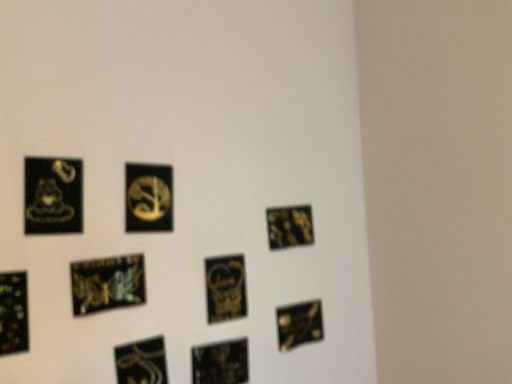
This screenshot has height=384, width=512. Describe the element at coordinates (13, 313) in the screenshot. I see `metallic gold picture frame at lower left, the first picture frame viewed from the left` at that location.

What do you see at coordinates (289, 226) in the screenshot? The image size is (512, 384). I see `metallic gold picture frame at center-right, placed as the 8th picture frame when sorted from left to right` at bounding box center [289, 226].

The height and width of the screenshot is (384, 512). I want to click on metallic gold picture frame at center-right, placed as the 8th picture frame when sorted from left to right, so click(289, 226).

Where is `black glossy sticker at lower left, which is the 4th picture frame from left to right`? black glossy sticker at lower left, which is the 4th picture frame from left to right is located at coordinates (141, 362).

Where is `gold metallic sign at center, which appears as the 3th picture frame when viewed from the right`? gold metallic sign at center, which appears as the 3th picture frame when viewed from the right is located at coordinates (225, 288).

Where is `metallic gold picture frame at lower left, the first picture frame viewed from the left`? The image size is (512, 384). metallic gold picture frame at lower left, the first picture frame viewed from the left is located at coordinates (13, 313).

Considering the positions of objects gold metallic sign at center, which appears as the 3th picture frame when viewed from the right, and metallic gold picture frame at center-right, which is the 2th picture frame from right to left, in the image provided, who is more to the left, gold metallic sign at center, which appears as the 3th picture frame when viewed from the right, or metallic gold picture frame at center-right, which is the 2th picture frame from right to left,?

gold metallic sign at center, which appears as the 3th picture frame when viewed from the right, is more to the left.

Considering the points (222, 311) and (307, 224), which point is behind, point (222, 311) or point (307, 224)?

Positioned behind is point (307, 224).

Is gold metallic sign at center, which appears as the 3th picture frame when viewed from the right, aimed at metallic gold picture frame at center-right, which is the 2th picture frame from right to left?

No, gold metallic sign at center, which appears as the 3th picture frame when viewed from the right, is not aimed at metallic gold picture frame at center-right, which is the 2th picture frame from right to left.

Is glossy black picture frame at lower left, the 7th picture frame positioned from the right, wider than matte black coffee cup at left, which is the 8th picture frame in right-to-left order?

Yes.

Is matte black coffee cup at left, which ranks as the 2th picture frame in left-to-right order, located within glossy black picture frame at lower left, the 7th picture frame positioned from the right?

Actually, matte black coffee cup at left, which ranks as the 2th picture frame in left-to-right order, is outside glossy black picture frame at lower left, the 7th picture frame positioned from the right.

Is glossy black picture frame at lower left, the 7th picture frame positioned from the right, placed right next to matte black coffee cup at left, which is the 8th picture frame in right-to-left order?

glossy black picture frame at lower left, the 7th picture frame positioned from the right, and matte black coffee cup at left, which is the 8th picture frame in right-to-left order, are not in contact.

Considering the positions of objects glossy black picture frame at lower left, the 7th picture frame positioned from the right, and matte black coffee cup at left, which ranks as the 2th picture frame in left-to-right order, in the image provided, who is more to the right, glossy black picture frame at lower left, the 7th picture frame positioned from the right, or matte black coffee cup at left, which ranks as the 2th picture frame in left-to-right order,?

Positioned to the right is glossy black picture frame at lower left, the 7th picture frame positioned from the right.

Can you confirm if gold metallic sign at center, which appears as the 3th picture frame when viewed from the right, is thinner than matte black coffee cup at left, which ranks as the 2th picture frame in left-to-right order?

No.

Is gold metallic sign at center, which appears as the 3th picture frame when viewed from the right, bigger than matte black coffee cup at left, which ranks as the 2th picture frame in left-to-right order?

Yes, gold metallic sign at center, which appears as the 3th picture frame when viewed from the right, is bigger than matte black coffee cup at left, which ranks as the 2th picture frame in left-to-right order.

From the image's perspective, between gold metallic sign at center, which appears as the 3th picture frame when viewed from the right, and matte black coffee cup at left, which is the 8th picture frame in right-to-left order, who is located below?

From the image's view, gold metallic sign at center, which appears as the 3th picture frame when viewed from the right, is below.

Which object is positioned more to the right, gold metallic sign at center, the 7th picture frame viewed from the left, or matte black coffee cup at left, which is the 8th picture frame in right-to-left order?

From the viewer's perspective, gold metallic sign at center, the 7th picture frame viewed from the left, appears more on the right side.

Can you confirm if metallic gold picture frame at lower left, the first picture frame viewed from the left, is taller than matte black coffee cup at left, which ranks as the 2th picture frame in left-to-right order?

In fact, metallic gold picture frame at lower left, the first picture frame viewed from the left, may be shorter than matte black coffee cup at left, which ranks as the 2th picture frame in left-to-right order.

From a real-world perspective, is metallic gold picture frame at lower left, the 9th picture frame viewed from the right, above or below matte black coffee cup at left, which is the 8th picture frame in right-to-left order?

In terms of real-world spatial position, metallic gold picture frame at lower left, the 9th picture frame viewed from the right, is below matte black coffee cup at left, which is the 8th picture frame in right-to-left order.

Would you say metallic gold picture frame at lower left, the 9th picture frame viewed from the right, is outside matte black coffee cup at left, which is the 8th picture frame in right-to-left order?

Absolutely, metallic gold picture frame at lower left, the 9th picture frame viewed from the right, is external to matte black coffee cup at left, which is the 8th picture frame in right-to-left order.

Could you tell me if metallic gold picture frame at lower left, the first picture frame viewed from the left, is facing matte black coffee cup at left, which ranks as the 2th picture frame in left-to-right order?

No.

Locate an element on the screen. the 2nd picture frame to the left of the black glossy sticker at lower left, positioned as the sixth picture frame in right-to-left order, starting your count from the anchor is located at coordinates (53, 196).

How different are the orientations of matte black coffee cup at left, which is the 8th picture frame in right-to-left order, and black glossy sticker at lower left, which is the 4th picture frame from left to right, in degrees?

There is a 0.552-degree angle between the facing directions of matte black coffee cup at left, which is the 8th picture frame in right-to-left order, and black glossy sticker at lower left, which is the 4th picture frame from left to right.

From the picture: From a real-world perspective, between matte black coffee cup at left, which ranks as the 2th picture frame in left-to-right order, and black glossy sticker at lower left, positioned as the sixth picture frame in right-to-left order, who is vertically lower?

black glossy sticker at lower left, positioned as the sixth picture frame in right-to-left order, is physically lower.

Is matte black coffee cup at left, which is the 8th picture frame in right-to-left order, next to black glossy sticker at lower left, which is the 4th picture frame from left to right?

matte black coffee cup at left, which is the 8th picture frame in right-to-left order, and black glossy sticker at lower left, which is the 4th picture frame from left to right, are clearly separated.

Which of these two, metallic gold picture frame at lower center, the 4th picture frame from the right, or glossy black picture frame at lower left, the third picture frame positioned from the left, is thinner?

glossy black picture frame at lower left, the third picture frame positioned from the left.

Could you tell me if metallic gold picture frame at lower center, marked as the 6th picture frame in a left-to-right arrangement, is turned towards glossy black picture frame at lower left, the 7th picture frame positioned from the right?

No, metallic gold picture frame at lower center, marked as the 6th picture frame in a left-to-right arrangement, is not turned towards glossy black picture frame at lower left, the 7th picture frame positioned from the right.

Between metallic gold picture frame at lower center, the 4th picture frame from the right, and glossy black picture frame at lower left, the 7th picture frame positioned from the right, which one appears on the left side from the viewer's perspective?

glossy black picture frame at lower left, the 7th picture frame positioned from the right.

Can you confirm if metallic gold picture frame at lower center, the 4th picture frame from the right, is smaller than glossy black picture frame at lower left, the 7th picture frame positioned from the right?

Incorrect, metallic gold picture frame at lower center, the 4th picture frame from the right, is not smaller in size than glossy black picture frame at lower left, the 7th picture frame positioned from the right.

Measure the distance between metallic gold picture frame at lower left, the first picture frame viewed from the left, and glossy black picture frame at lower left, the 7th picture frame positioned from the right.

They are 7.48 inches apart.

Is metallic gold picture frame at lower left, the first picture frame viewed from the left, wider than glossy black picture frame at lower left, the 7th picture frame positioned from the right?

No.

Is metallic gold picture frame at lower left, the first picture frame viewed from the left, to the left or to the right of glossy black picture frame at lower left, the 7th picture frame positioned from the right, in the image?

Based on their positions, metallic gold picture frame at lower left, the first picture frame viewed from the left, is located to the left of glossy black picture frame at lower left, the 7th picture frame positioned from the right.

Can you tell me how much metallic gold picture frame at lower left, the 9th picture frame viewed from the right, and glossy black picture frame at lower left, the 7th picture frame positioned from the right, differ in facing direction?

There is a 0.476-degree angle between the facing directions of metallic gold picture frame at lower left, the 9th picture frame viewed from the right, and glossy black picture frame at lower left, the 7th picture frame positioned from the right.

Identify the location of the 1st picture frame counting from the left of the metallic gold picture frame at center-right, placed as the 8th picture frame when sorted from left to right. (225, 288).

Identify the location of picture frame that is the 3rd one when counting upward from the glossy black picture frame at lower left, the 7th picture frame positioned from the right (from the image's perspective). (53, 196).

Considering their positions, is glossy black picture frame at lower left, the third picture frame positioned from the left, positioned further to metallic gold picture frame at center-right, which is the 2th picture frame from right to left, than matte black coffee cup at left, which ranks as the 2th picture frame in left-to-right order?

matte black coffee cup at left, which ranks as the 2th picture frame in left-to-right order, is positioned further to the anchor metallic gold picture frame at center-right, which is the 2th picture frame from right to left.

Estimate the real-world distances between objects in this image. Which object is closer to metallic gold picture frame at center-right, which is the 2th picture frame from right to left, matte black coffee cup at left, which is the 8th picture frame in right-to-left order, or metallic gold picture frame at lower left, the first picture frame viewed from the left?

Among the two, matte black coffee cup at left, which is the 8th picture frame in right-to-left order, is located nearer to metallic gold picture frame at center-right, which is the 2th picture frame from right to left.

Looking at the image, which one is located closer to metallic gold picture frame at lower left, the 9th picture frame viewed from the right, metallic gold picture frame at center-right, placed as the 8th picture frame when sorted from left to right, or matte black coffee cup at left, which ranks as the 2th picture frame in left-to-right order?

matte black coffee cup at left, which ranks as the 2th picture frame in left-to-right order.

Estimate the real-world distances between objects in this image. Which object is further from black glossy sticker at lower left, positioned as the sixth picture frame in right-to-left order, metallic gold picture frame at lower center, the 4th picture frame from the right, or gold metallic sign at center, the 5th picture frame viewed from the right?

Among the two, gold metallic sign at center, the 5th picture frame viewed from the right, is located further to black glossy sticker at lower left, positioned as the sixth picture frame in right-to-left order.

Based on their spatial positions, is glossy black picture frame at lower left, the 7th picture frame positioned from the right, or black glossy square at bottom right, the 1th picture frame when ordered from right to left, closer to matte black coffee cup at left, which ranks as the 2th picture frame in left-to-right order?

Among the two, glossy black picture frame at lower left, the 7th picture frame positioned from the right, is located nearer to matte black coffee cup at left, which ranks as the 2th picture frame in left-to-right order.

Consider the image. Considering their positions, is metallic gold picture frame at lower center, marked as the 6th picture frame in a left-to-right arrangement, positioned further to matte black coffee cup at left, which ranks as the 2th picture frame in left-to-right order, than black glossy square at bottom right, arranged as the ninth picture frame when viewed from the left?

black glossy square at bottom right, arranged as the ninth picture frame when viewed from the left, is further to matte black coffee cup at left, which ranks as the 2th picture frame in left-to-right order.

When comparing their distances from black glossy square at bottom right, arranged as the ninth picture frame when viewed from the left, does matte black coffee cup at left, which is the 8th picture frame in right-to-left order, or glossy black picture frame at lower left, the 7th picture frame positioned from the right, seem further?

matte black coffee cup at left, which is the 8th picture frame in right-to-left order, lies further to black glossy square at bottom right, arranged as the ninth picture frame when viewed from the left, than the other object.

When comparing their distances from matte black coffee cup at left, which is the 8th picture frame in right-to-left order, does glossy black picture frame at lower left, the third picture frame positioned from the left, or metallic gold picture frame at lower left, the first picture frame viewed from the left, seem further?

metallic gold picture frame at lower left, the first picture frame viewed from the left, lies further to matte black coffee cup at left, which is the 8th picture frame in right-to-left order, than the other object.